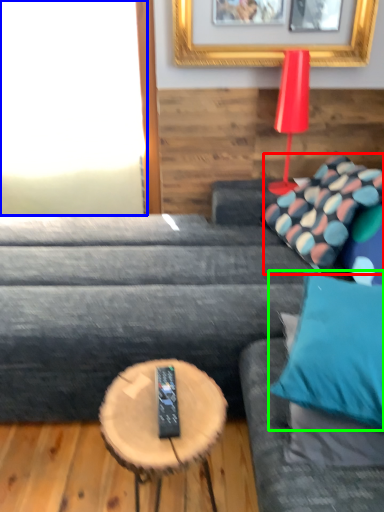
Question: Based on their relative distances, which object is nearer to pillow (highlighted by a red box)? Choose from window (highlighted by a blue box) and pillow (highlighted by a green box).

Choices:
 (A) window
 (B) pillow

Answer: (B)